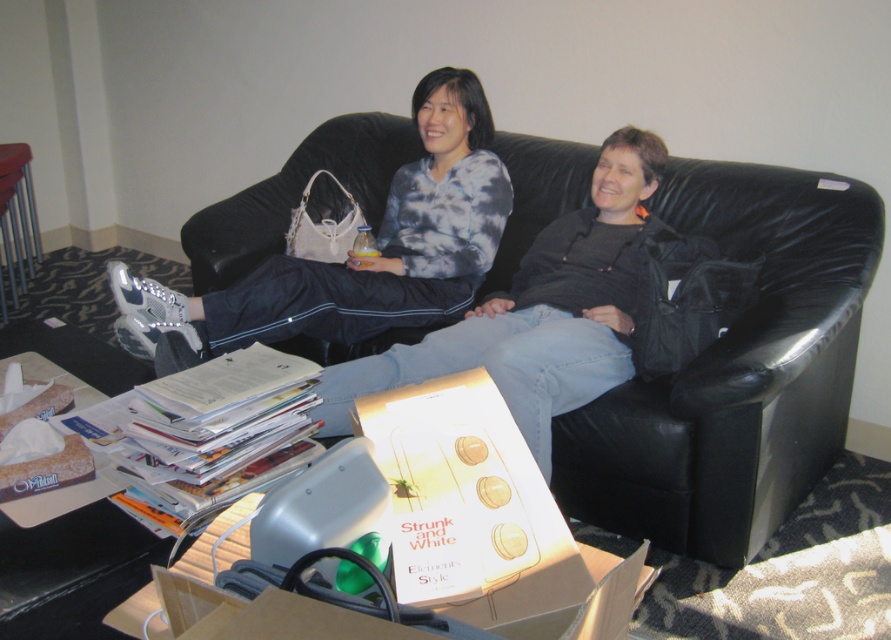
You are standing at the entrance of the room and want to sit on the black leather couch at center. According to the coordinates provided, in which direction should you move relative to your current position?

The black leather couch at center is located at coordinates point (734,371), so you should move towards the center of the room to reach it.

You are a delivery person who needs to place a small package on the coffee table in the scene. However, there is an object at the center of the table. Where exactly is the matte gray sweatpants at center located?

The matte gray sweatpants at center is located at point (375, 248) on the coffee table.

You are standing in the living room and want to place a small plant between the two points marked as point (x=835, y=305) and point (x=375, y=308). Which point should the plant be closer to in order to be closer to you?

The plant should be placed closer to point (x=835, y=305) because it is closer to the viewer than point (x=375, y=308).